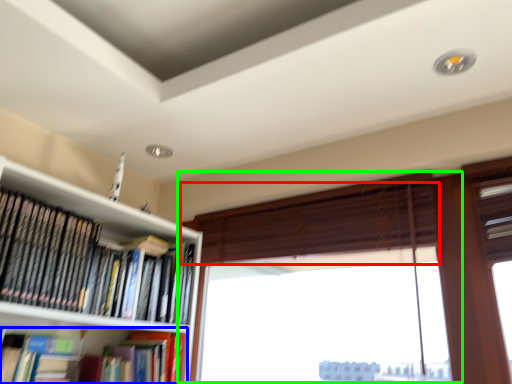
Question: Estimate the real-world distances between objects in this image. Which object is closer to blind (highlighted by a red box), book (highlighted by a blue box) or window (highlighted by a green box)?

Choices:
 (A) book
 (B) window

Answer: (B)